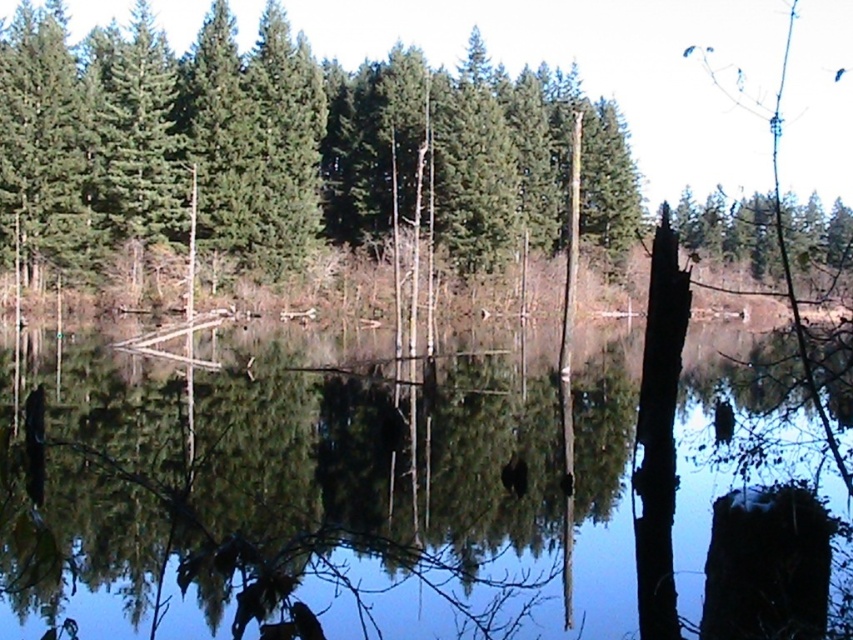
Which is behind, point (173, 420) or point (35, 65)?

The point (35, 65) is more distant.

Can you confirm if transparent water at center is smaller than green matte tree at upper center?

Indeed, transparent water at center has a smaller size compared to green matte tree at upper center.

Describe the element at coordinates (292, 458) in the screenshot. I see `transparent water at center` at that location.

At what (x,y) coordinates should I click in order to perform the action: click on transparent water at center. Please return your answer as a coordinate pair (x, y). The image size is (853, 640). Looking at the image, I should click on (292, 458).

Consider the image. Does transparent water at center lie behind green matte tree at upper right?

That is False.

Who is more distant from viewer, (419, 605) or (809, 253)?

The point (809, 253) is more distant.

You are a GUI agent. You are given a task and a screenshot of the screen. Output one action in this format:
    pyautogui.click(x=<x>, y=<y>)
    Task: Click on the transparent water at center
    The image size is (853, 640).
    Given the screenshot: What is the action you would take?
    pyautogui.click(x=292, y=458)

The image size is (853, 640). I want to click on green matte tree at upper center, so click(285, 145).

Is point (86, 44) in front of point (750, 196)?

That is True.

I want to click on green matte tree at upper center, so click(x=285, y=145).

I want to click on green matte tree at upper center, so click(x=285, y=145).